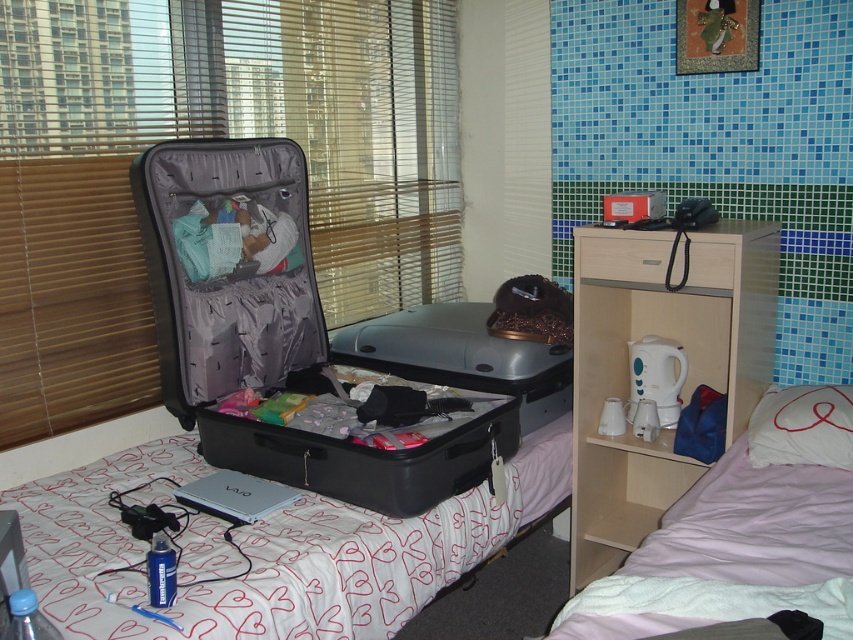
You are organizing the items in the bedroom and need to place a new item between the pink fabric bedcover at lower right and the wooden drawer at center. Based on their positions, where should you place the new item?

The new item should be placed between the pink fabric bedcover at lower right and the wooden drawer at center. Since the pink fabric bedcover at lower right is below the wooden drawer at center, the new item can be placed either above the bedcover or below the drawer to fit between them.

You are standing in the bedroom and want to place a small object on the closest point between the two points, point 1 at coordinates (631, 554) and point 2 at coordinates (666, 234). Which point should you choose?

Point 1 at coordinates (631, 554) is closer to you than point 2 at coordinates (666, 234), so you should choose point 1 at coordinates (631, 554) to place the object.